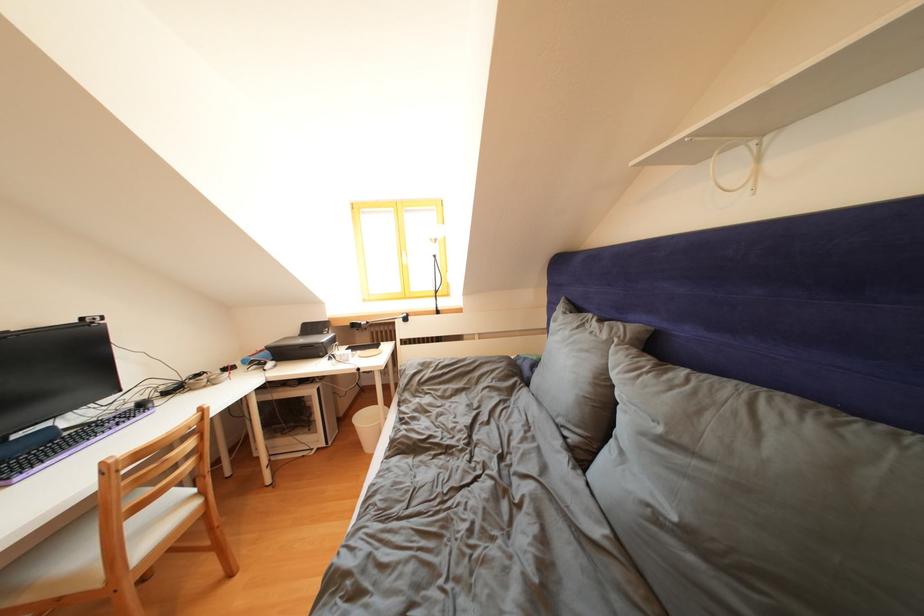
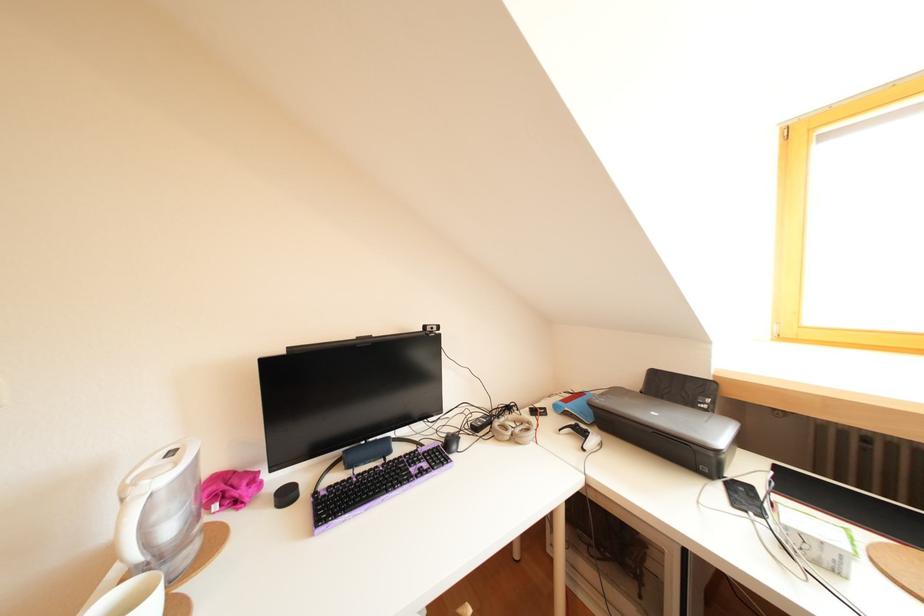
In the second image, find the point that corresponds to pixel 205 381 in the first image.

(516, 413)